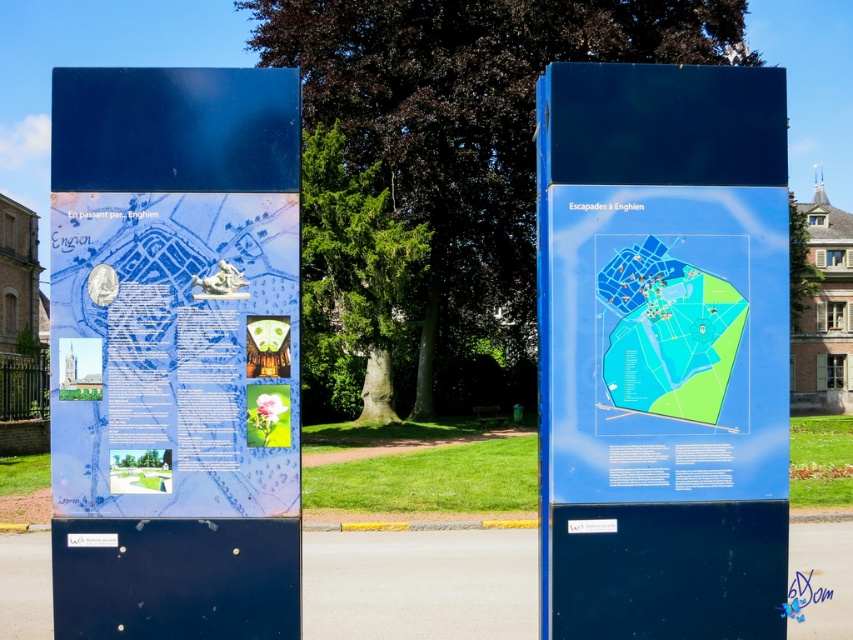
Question: Does blue glossy poster at left have a lesser width compared to transparent plastic map at center?

Choices:
 (A) no
 (B) yes

Answer: (A)

Question: Which object appears closest to the camera in this image?

Choices:
 (A) transparent plastic map at center
 (B) blue glossy poster at left

Answer: (B)

Question: Which object appears farthest from the camera in this image?

Choices:
 (A) blue glossy poster at left
 (B) blue glossy map at center

Answer: (B)

Question: Is blue glossy map at center below blue glossy poster at left?

Choices:
 (A) no
 (B) yes

Answer: (A)

Question: Which of these objects is positioned closest to the transparent plastic map at center?

Choices:
 (A) blue glossy map at center
 (B) blue glossy poster at left

Answer: (A)

Question: Can you confirm if blue glossy map at center is positioned below transparent plastic map at center?

Choices:
 (A) no
 (B) yes

Answer: (B)